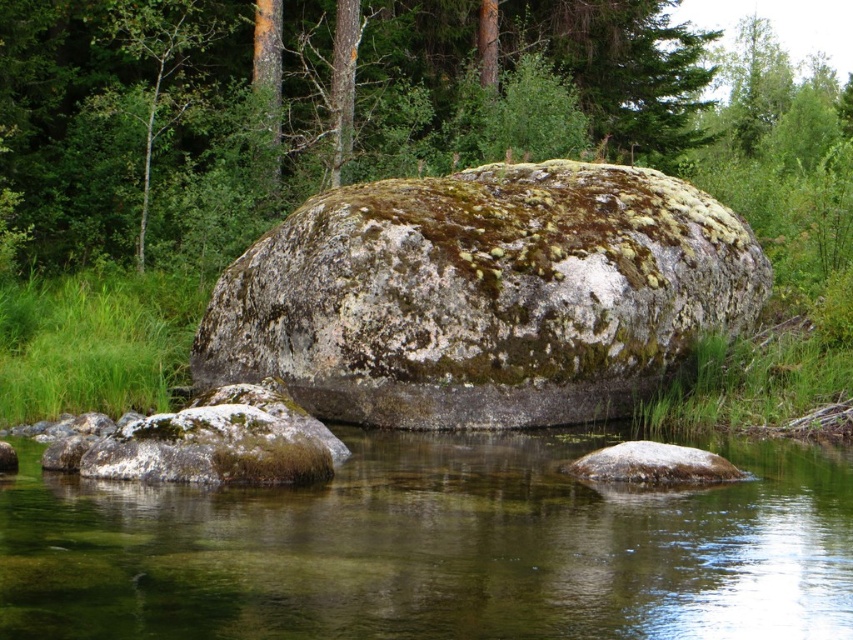
Question: Can you confirm if green mossy rock at lower left is positioned below smooth gray rock at center?

Choices:
 (A) yes
 (B) no

Answer: (B)

Question: Which of these objects is positioned farthest from the smooth gray rock at center?

Choices:
 (A) clear water at center
 (B) green mossy rock at center
 (C) green mossy rock at lower left

Answer: (B)

Question: Which point is closer to the camera?

Choices:
 (A) (633, 468)
 (B) (550, 163)
 (C) (306, 460)

Answer: (C)

Question: Which is nearer to the green mossy rock at center?

Choices:
 (A) smooth gray rock at center
 (B) clear water at center
 (C) green mossy rock at lower left

Answer: (A)

Question: Is clear water at center below smooth gray rock at center?

Choices:
 (A) no
 (B) yes

Answer: (B)

Question: Can you confirm if clear water at center is positioned above green mossy rock at center?

Choices:
 (A) yes
 (B) no

Answer: (B)